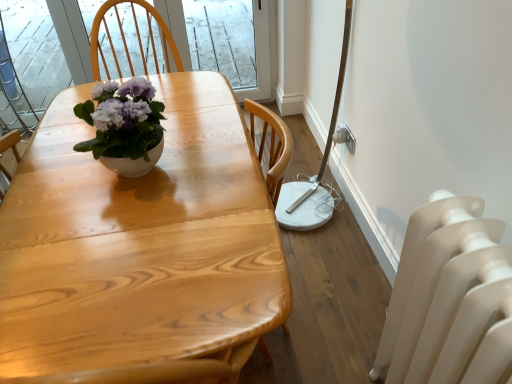
Question: From a real-world perspective, is natural wood table at center physically located above or below white glossy pot at center?

Choices:
 (A) above
 (B) below

Answer: (B)

Question: In terms of size, does natural wood table at center appear bigger or smaller than white glossy pot at center?

Choices:
 (A) small
 (B) big

Answer: (B)

Question: Which is farther from the white glossy pot at center?

Choices:
 (A) natural wood table at center
 (B) white matte radiator at lower right

Answer: (B)

Question: Estimate the real-world distances between objects in this image. Which object is farther from the white glossy pot at center?

Choices:
 (A) white matte radiator at lower right
 (B) natural wood table at center

Answer: (A)